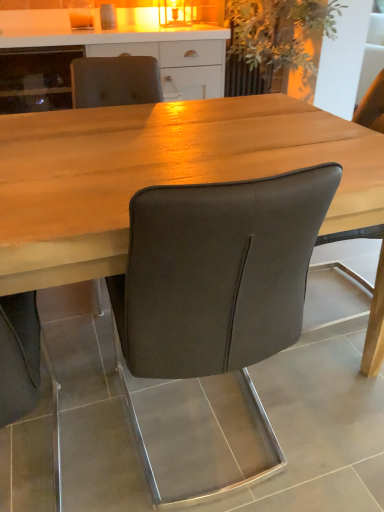
Question: From the image's perspective, is wooden table at center above or below dark gray leather chair at center?

Choices:
 (A) above
 (B) below

Answer: (A)

Question: Is wooden table at center wider or thinner than dark gray leather chair at center?

Choices:
 (A) thin
 (B) wide

Answer: (B)

Question: Which object is the farthest from the wooden table at center?

Choices:
 (A) dark gray leather chair at center
 (B) matte white cabinet at upper center
 (C) green leafy plant at upper center

Answer: (C)

Question: Estimate the real-world distances between objects in this image. Which object is farther from the green leafy plant at upper center?

Choices:
 (A) dark gray leather chair at center
 (B) wooden table at center
 (C) matte white cabinet at upper center

Answer: (A)